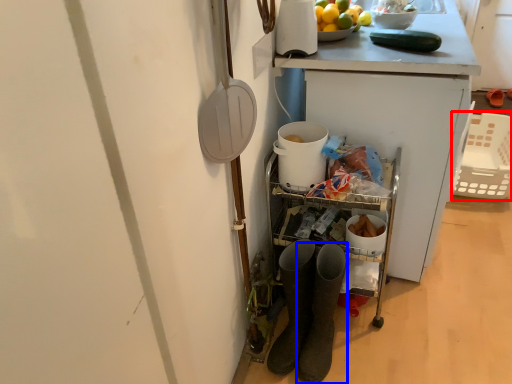
Question: Which point is further to the camera, basket (highlighted by a red box) or footwear (highlighted by a blue box)?

Choices:
 (A) basket
 (B) footwear

Answer: (A)